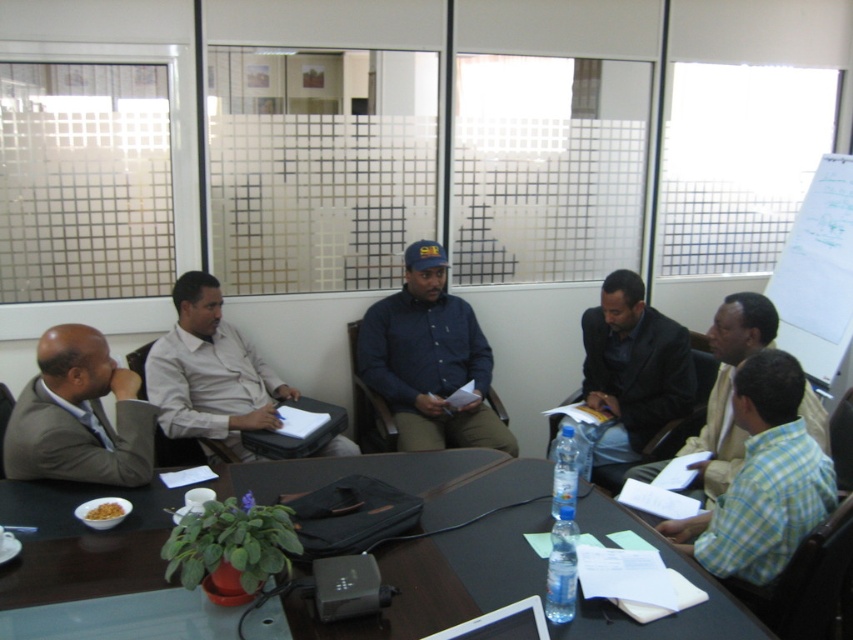
The width and height of the screenshot is (853, 640). I want to click on matte gray shirt at center, so click(210, 372).

Who is positioned more to the left, matte gray shirt at center or light brown shirt at center?

Positioned to the left is matte gray shirt at center.

This screenshot has width=853, height=640. What are the coordinates of `matte gray shirt at center` in the screenshot? It's located at (210, 372).

Which is more to the left, brown wooden table at center or matte gray shirt at center?

matte gray shirt at center is more to the left.

From the picture: Can you confirm if brown wooden table at center is smaller than matte gray shirt at center?

Actually, brown wooden table at center might be larger than matte gray shirt at center.

Who is more forward, (19, 579) or (218, 344)?

Positioned in front is point (19, 579).

I want to click on brown wooden table at center, so click(x=445, y=579).

Is point (82, 396) closer to camera compared to point (811, 426)?

Yes, it is.

Who is higher up, light brown suit at left or light brown shirt at center?

light brown suit at left

Between point (122, 483) and point (724, 360), which one is positioned in front?

Point (122, 483) is in front.

Find the location of `light brown suit at left`. light brown suit at left is located at coordinates (79, 416).